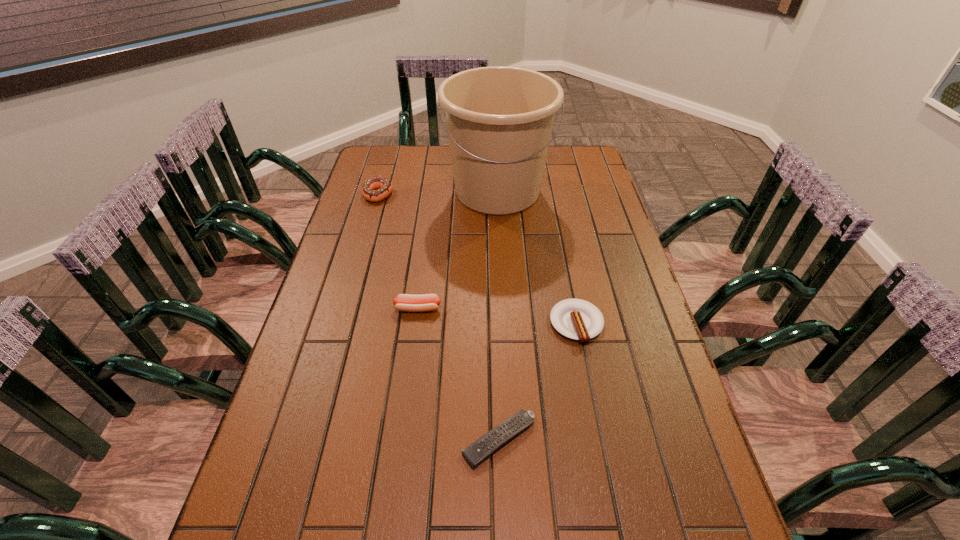
Identify the location of bucket. (499, 119).

Identify the location of the leftmost object. (384, 187).

At what (x,y) coordinates should I click in order to perform the action: click on doughnut. Please return your answer as a coordinate pair (x, y). Image resolution: width=960 pixels, height=540 pixels. Looking at the image, I should click on (384, 187).

Image resolution: width=960 pixels, height=540 pixels. I want to click on the left sausage, so click(x=404, y=302).

You are a GUI agent. You are given a task and a screenshot of the screen. Output one action in this format:
    pyautogui.click(x=<x>, y=<y>)
    Task: Click on the right sausage
    
    Given the screenshot: What is the action you would take?
    pyautogui.click(x=577, y=319)

The image size is (960, 540). In order to click on the nearest object in this screenshot , I will do `click(478, 451)`.

Image resolution: width=960 pixels, height=540 pixels. Find the location of `remote control`. remote control is located at coordinates (478, 451).

What are the coordinates of `vacant region located 0.280m on the left of the tallest object` in the screenshot? It's located at (368, 191).

The height and width of the screenshot is (540, 960). I want to click on vacant area located on the back of the leftmost object, so click(x=384, y=172).

Identify the location of vacant space located on the right of the left sausage. (550, 308).